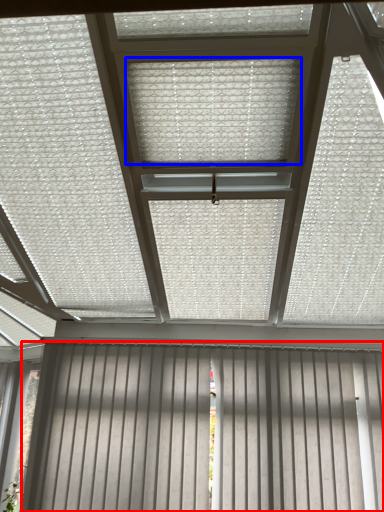
Question: Which point is further to the camera, garage door (highlighted by a red box) or blind (highlighted by a blue box)?

Choices:
 (A) garage door
 (B) blind

Answer: (A)